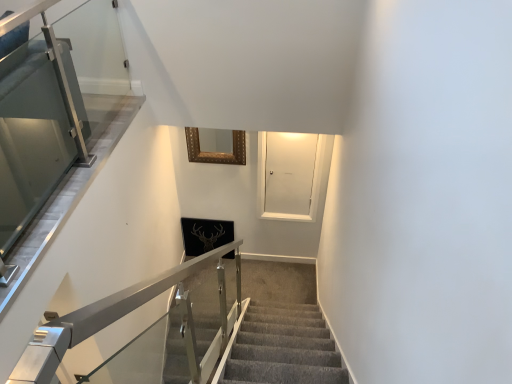
Identify the location of white glossy door at upper center. The height and width of the screenshot is (384, 512). (288, 176).

This screenshot has height=384, width=512. Describe the element at coordinates (288, 176) in the screenshot. I see `white glossy door at upper center` at that location.

You are a GUI agent. You are given a task and a screenshot of the screen. Output one action in this format:
    pyautogui.click(x=<x>, y=<y>)
    Task: Click on the white glossy door at upper center
    
    Given the screenshot: What is the action you would take?
    pyautogui.click(x=288, y=176)